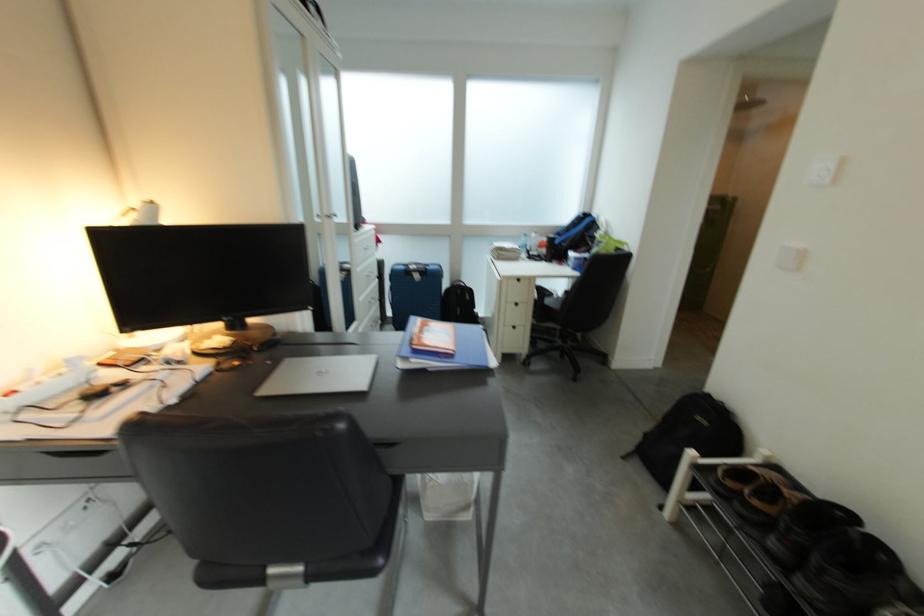
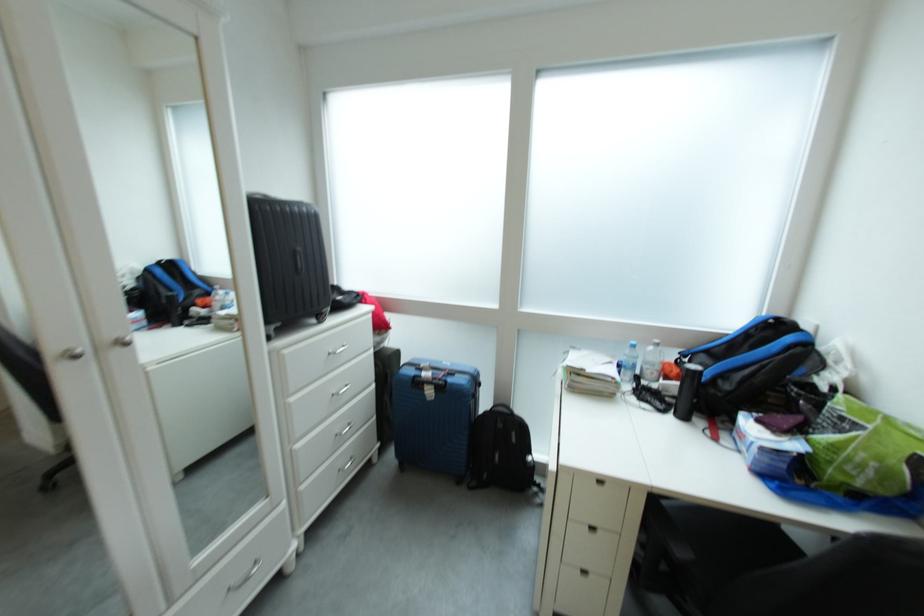
The point at (x=423, y=278) is marked in the first image. Where is the corresponding point in the second image?

(434, 392)